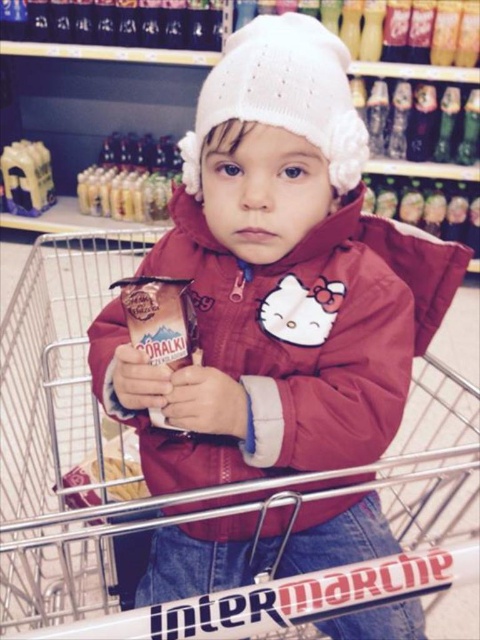
You are a parent trying to decide if your child can safely sit in the shopping cart. Considering the size of the metallic silver shopping cart at center and the white knitted hat at upper center, which one is bigger?

The metallic silver shopping cart at center is larger in size compared to the white knitted hat at upper center, so the child can safely sit in the shopping cart.

Based on the photo, you are a parent trying to find your child in a crowded supermarket. You remember your child was wearing a matte red jacket at center and standing inside a metallic silver shopping cart at center. Based on the description, which object is positioned to the right of the other?

The metallic silver shopping cart at center is to the left of matte red jacket at center, so the matte red jacket at center is positioned to the right of the metallic silver shopping cart at center.